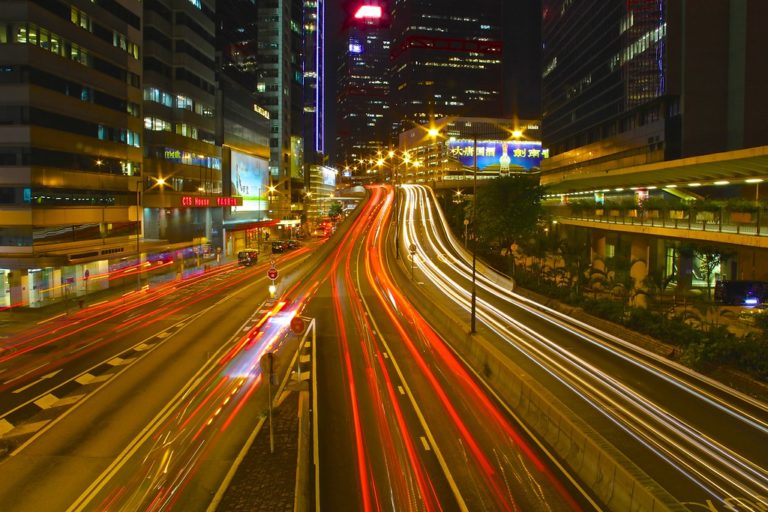
This screenshot has width=768, height=512. Identify the location of lamp lights. click(x=434, y=128), click(x=515, y=128).